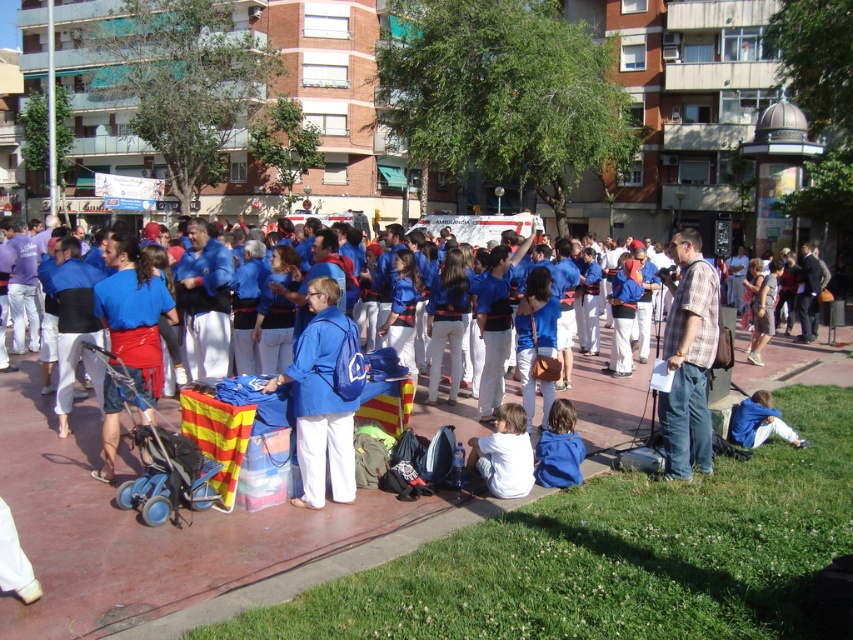
Is blue fabric bag at center in front of white cotton shirt at lower center?

That is True.

This screenshot has width=853, height=640. Identify the location of blue fabric bag at center. (161, 531).

At what (x,y) coordinates should I click in order to perform the action: click on blue fabric bag at center. Please return your answer as a coordinate pair (x, y). Looking at the image, I should click on (161, 531).

Who is shorter, plaid fabric shirt at right or white cotton shirt at lower center?

Standing shorter between the two is white cotton shirt at lower center.

Who is more distant from viewer, (704, 400) or (505, 497)?

Point (704, 400)

The image size is (853, 640). Find the location of `plaid fabric shirt at right`. plaid fabric shirt at right is located at coordinates (688, 358).

Which is in front, point (697, 275) or point (106, 356)?

Positioned in front is point (106, 356).

Is plaid fabric shirt at right smaller than blue plastic baby carriage at lower left?

No.

Does point (697, 429) lie in front of point (97, 353)?

No, (697, 429) is further to viewer.

At what (x,y) coordinates should I click in order to perform the action: click on plaid fabric shirt at right. Please return your answer as a coordinate pair (x, y). Looking at the image, I should click on (688, 358).